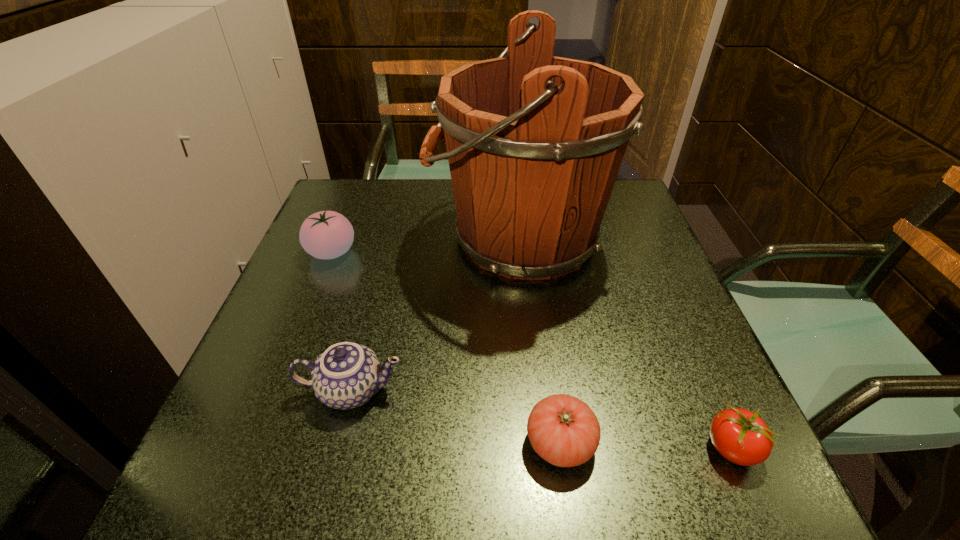
Locate an element on the screen. empty space between the tallest tomato and the bucket is located at coordinates (425, 245).

The height and width of the screenshot is (540, 960). I want to click on free space between the second tomato from right to left and the rightmost object, so click(645, 446).

The height and width of the screenshot is (540, 960). What are the coordinates of `free area in between the farthest tomato and the tallest object` in the screenshot? It's located at (425, 245).

You are a GUI agent. You are given a task and a screenshot of the screen. Output one action in this format:
    pyautogui.click(x=<x>, y=<y>)
    Task: Click on the vacant area between the chinaware and the tallest object
    The image size is (960, 540).
    Given the screenshot: What is the action you would take?
    pyautogui.click(x=435, y=314)

You are a GUI agent. You are given a task and a screenshot of the screen. Output one action in this format:
    pyautogui.click(x=<x>, y=<y>)
    Task: Click on the object that can be found as the third closest to the bucket
    The width and height of the screenshot is (960, 540).
    Given the screenshot: What is the action you would take?
    pyautogui.click(x=563, y=430)

The width and height of the screenshot is (960, 540). What are the coordinates of `the second closest object to the rightmost object` in the screenshot? It's located at (535, 142).

Locate an element on the screen. The width and height of the screenshot is (960, 540). tomato that is the second closest one to the bucket is located at coordinates pyautogui.click(x=563, y=430).

Locate an element on the screen. Image resolution: width=960 pixels, height=540 pixels. tomato that stands as the closest to the tallest object is located at coordinates (327, 234).

I want to click on free space that satisfies the following two spatial constraints: 1. with the handle on the side of the tallest object; 2. on the left side of the second tomato from left to right, so click(x=540, y=442).

Find the location of `free space in the image that satisfies the following two spatial constraints: 1. on the back side of the second tomato from left to right; 2. with the handle on the side of the tallest object`. free space in the image that satisfies the following two spatial constraints: 1. on the back side of the second tomato from left to right; 2. with the handle on the side of the tallest object is located at coordinates (531, 238).